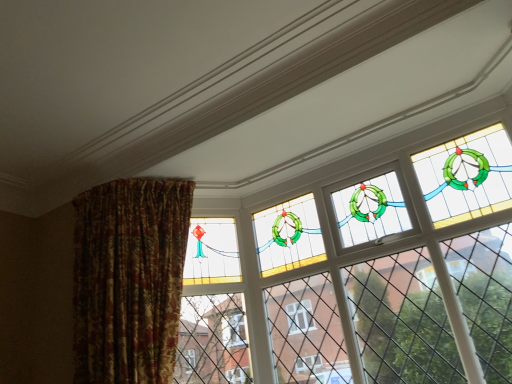
Measure the distance between point [146,217] and camera.

The depth of point [146,217] is 2.54 meters.

This screenshot has height=384, width=512. I want to click on floral fabric curtain at left, so click(129, 279).

The height and width of the screenshot is (384, 512). What do you see at coordinates (129, 279) in the screenshot?
I see `floral fabric curtain at left` at bounding box center [129, 279].

What do you see at coordinates (364, 267) in the screenshot? I see `stained glass window at upper center` at bounding box center [364, 267].

In order to click on stained glass window at upper center in this screenshot , I will do coord(364,267).

Find the location of `floral fabric curtain at left`. floral fabric curtain at left is located at coordinates (129, 279).

Is floral fabric curtain at left at the right side of stained glass window at upper center?

No, floral fabric curtain at left is not to the right of stained glass window at upper center.

Is the position of floral fabric curtain at left more distant than that of stained glass window at upper center?

Yes, it is behind stained glass window at upper center.

Which is less distant, (120, 304) or (300, 324)?

Point (120, 304)

From the image's perspective, is floral fabric curtain at left above or below stained glass window at upper center?

floral fabric curtain at left is situated lower than stained glass window at upper center in the image.

From a real-world perspective, is floral fabric curtain at left located higher than stained glass window at upper center?

Yes, from a real-world perspective, floral fabric curtain at left is above stained glass window at upper center.

Which of these two, floral fabric curtain at left or stained glass window at upper center, is wider?

floral fabric curtain at left is wider.

From their relative heights in the image, would you say floral fabric curtain at left is taller or shorter than stained glass window at upper center?

Clearly, floral fabric curtain at left is shorter compared to stained glass window at upper center.

Between floral fabric curtain at left and stained glass window at upper center, which one has smaller size?

stained glass window at upper center is smaller.

Is floral fabric curtain at left positioned beyond the bounds of stained glass window at upper center?

Yes, floral fabric curtain at left is outside of stained glass window at upper center.

Is floral fabric curtain at left far away from stained glass window at upper center?

That's not correct — floral fabric curtain at left is a little close to stained glass window at upper center.

Is floral fabric curtain at left turned away from stained glass window at upper center?

No, floral fabric curtain at left is not facing away from stained glass window at upper center.

In the scene shown: How different are the orientations of floral fabric curtain at left and stained glass window at upper center in degrees?

They differ by 33.2 degrees in their facing directions.

At what (x,y) coordinates should I click in order to perform the action: click on curtain on the left side of stained glass window at upper center. Please return your answer as a coordinate pair (x, y). The image size is (512, 384). Looking at the image, I should click on (129, 279).

Considering the positions of objects stained glass window at upper center and floral fabric curtain at left in the image provided, who is more to the left, stained glass window at upper center or floral fabric curtain at left?

floral fabric curtain at left is more to the left.

Which object is closer to the camera, stained glass window at upper center or floral fabric curtain at left?

stained glass window at upper center is more forward.

Does point (216, 228) appear closer or farther from the camera than point (170, 233)?

Point (216, 228).

From the picture: From the image's perspective, between stained glass window at upper center and floral fabric curtain at left, which one is located above?

From the image's view, stained glass window at upper center is above.

From a real-world perspective, is stained glass window at upper center located higher than floral fabric curtain at left?

No.

Looking at their sizes, would you say stained glass window at upper center is wider or thinner than floral fabric curtain at left?

Considering their sizes, stained glass window at upper center looks slimmer than floral fabric curtain at left.

Considering the sizes of stained glass window at upper center and floral fabric curtain at left in the image, is stained glass window at upper center taller or shorter than floral fabric curtain at left?

Considering their sizes, stained glass window at upper center has more height than floral fabric curtain at left.

Considering the sizes of objects stained glass window at upper center and floral fabric curtain at left in the image provided, who is smaller, stained glass window at upper center or floral fabric curtain at left?

With smaller size is stained glass window at upper center.

Is stained glass window at upper center situated inside floral fabric curtain at left or outside?

stained glass window at upper center cannot be found inside floral fabric curtain at left.

Would you consider stained glass window at upper center to be distant from floral fabric curtain at left?

Actually, stained glass window at upper center and floral fabric curtain at left are a little close together.

Is stained glass window at upper center oriented away from floral fabric curtain at left?

No, stained glass window at upper center's orientation is not away from floral fabric curtain at left.

How different are the orientations of stained glass window at upper center and floral fabric curtain at left in degrees?

The angular difference between stained glass window at upper center and floral fabric curtain at left is 33.2 degrees.

This screenshot has width=512, height=384. I want to click on curtain above the stained glass window at upper center (from a real-world perspective), so click(x=129, y=279).

You are a GUI agent. You are given a task and a screenshot of the screen. Output one action in this format:
    pyautogui.click(x=<x>, y=<y>)
    Task: Click on the curtain that appears behind the stained glass window at upper center
    
    Given the screenshot: What is the action you would take?
    pyautogui.click(x=129, y=279)

Find the location of `curtain on the left of stained glass window at upper center`. curtain on the left of stained glass window at upper center is located at coordinates (129, 279).